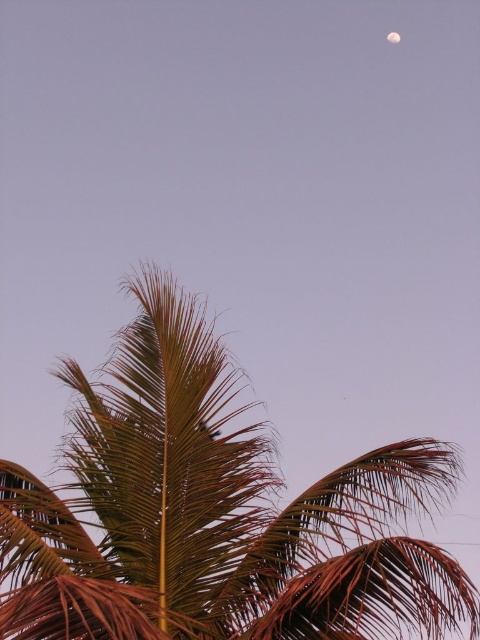
Question: Does brown leafy coconut tree at upper center have a smaller size compared to smooth gray moon at upper right?

Choices:
 (A) yes
 (B) no

Answer: (B)

Question: Is brown leafy coconut tree at upper center positioned behind smooth gray moon at upper right?

Choices:
 (A) yes
 (B) no

Answer: (B)

Question: Does brown leafy coconut tree at upper center appear on the left side of smooth gray moon at upper right?

Choices:
 (A) no
 (B) yes

Answer: (B)